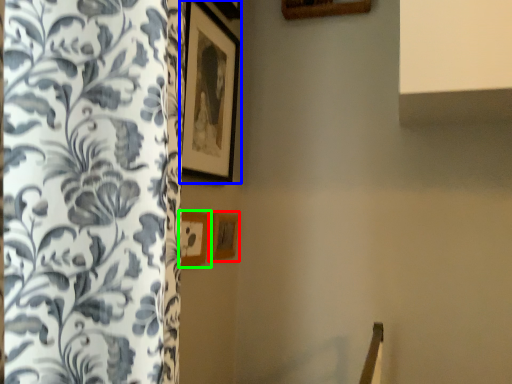
Question: Which object is positioned closest to picture frame (highlighted by a red box)? Select from picture frame (highlighted by a blue box) and picture frame (highlighted by a green box).

Choices:
 (A) picture frame
 (B) picture frame

Answer: (B)